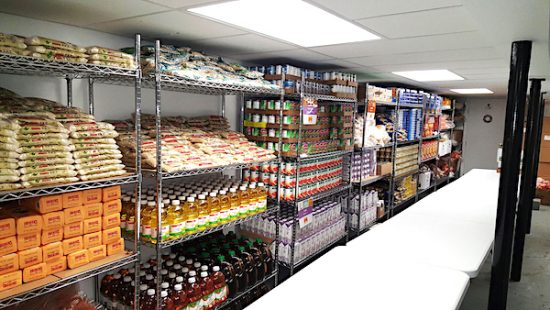
Identify the location of ceiling lights. This screenshot has width=550, height=310. (312, 17), (432, 72), (471, 90).